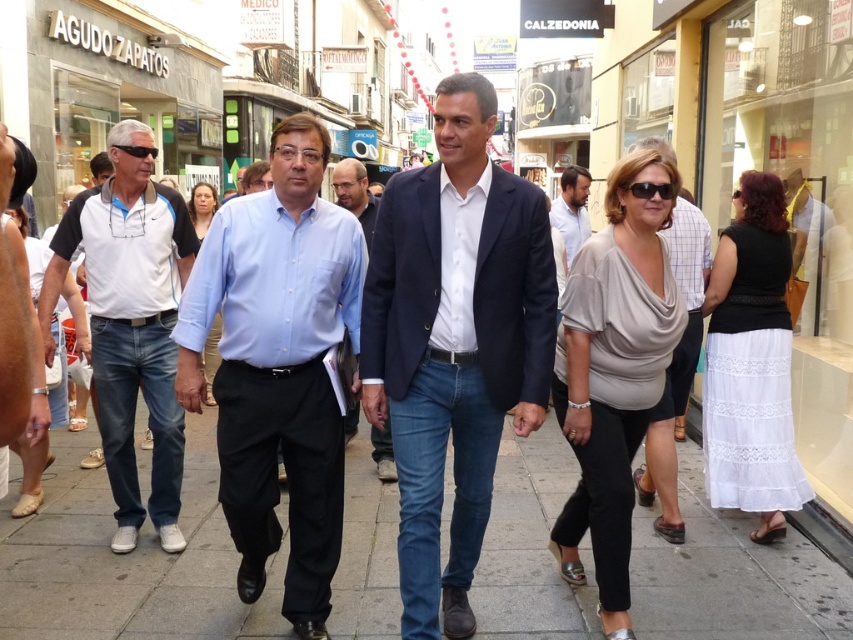
Who is higher up, matte gray blouse at center or denim jeans at left?

Positioned higher is denim jeans at left.

Which is behind, point (596, 321) or point (115, 509)?

The point (115, 509) is more distant.

I want to click on matte gray blouse at center, so click(x=613, y=374).

Who is more distant from viewer, (283, 596) or (743, 461)?

Positioned behind is point (743, 461).

Between point (346, 214) and point (733, 433), which one is positioned in front?

Point (346, 214) is in front.

At what (x,y) coordinates should I click in order to perform the action: click on light blue button-down shirt at center. Please return your answer as a coordinate pair (x, y). The height and width of the screenshot is (640, 853). Looking at the image, I should click on (277, 365).

What are the coordinates of `navy blue suit at center` in the screenshot? It's located at (454, 342).

Which of these two, navy blue suit at center or white lace skirt at right, stands shorter?

white lace skirt at right

Is point (428, 300) in front of point (746, 458)?

Yes, point (428, 300) is in front of point (746, 458).

Locate an element on the screen. The height and width of the screenshot is (640, 853). navy blue suit at center is located at coordinates (454, 342).